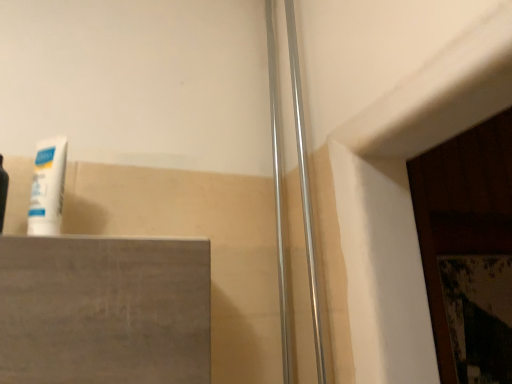
Question: Visually, is white matte tube at left positioned to the left or to the right of satin silver shower door at center?

Choices:
 (A) left
 (B) right

Answer: (A)

Question: Considering their positions, is white matte tube at left located in front of or behind satin silver shower door at center?

Choices:
 (A) behind
 (B) front

Answer: (B)

Question: From the image's perspective, is white matte tube at left positioned above or below satin silver shower door at center?

Choices:
 (A) above
 (B) below

Answer: (B)

Question: Is satin silver shower door at center to the left or to the right of white matte tube at left in the image?

Choices:
 (A) left
 (B) right

Answer: (B)

Question: Is satin silver shower door at center inside or outside of white matte tube at left?

Choices:
 (A) outside
 (B) inside

Answer: (A)

Question: Looking at their shapes, would you say satin silver shower door at center is wider or thinner than white matte tube at left?

Choices:
 (A) wide
 (B) thin

Answer: (B)

Question: From a real-world perspective, is satin silver shower door at center physically located above or below white matte tube at left?

Choices:
 (A) above
 (B) below

Answer: (A)